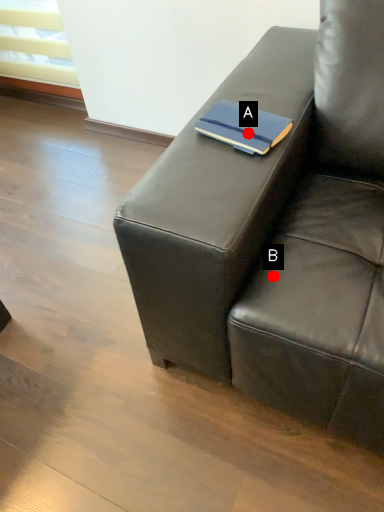
Question: Two points are circled on the image, labeled by A and B beside each circle. Which point is further to the camera?

Choices:
 (A) A is further
 (B) B is further

Answer: (A)